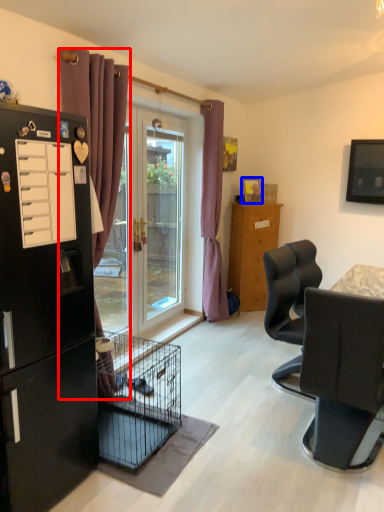
Question: Which object is further to the camera taking this photo, curtain (highlighted by a red box) or picture frame (highlighted by a blue box)?

Choices:
 (A) curtain
 (B) picture frame

Answer: (B)